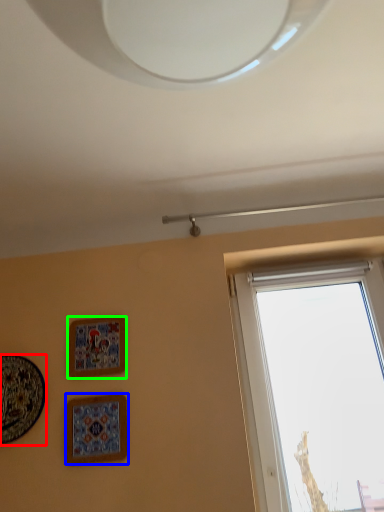
Question: Considering the real-world distances, which object is closest to picture frame (highlighted by a red box)? picture frame (highlighted by a blue box) or picture frame (highlighted by a green box).

Choices:
 (A) picture frame
 (B) picture frame

Answer: (A)